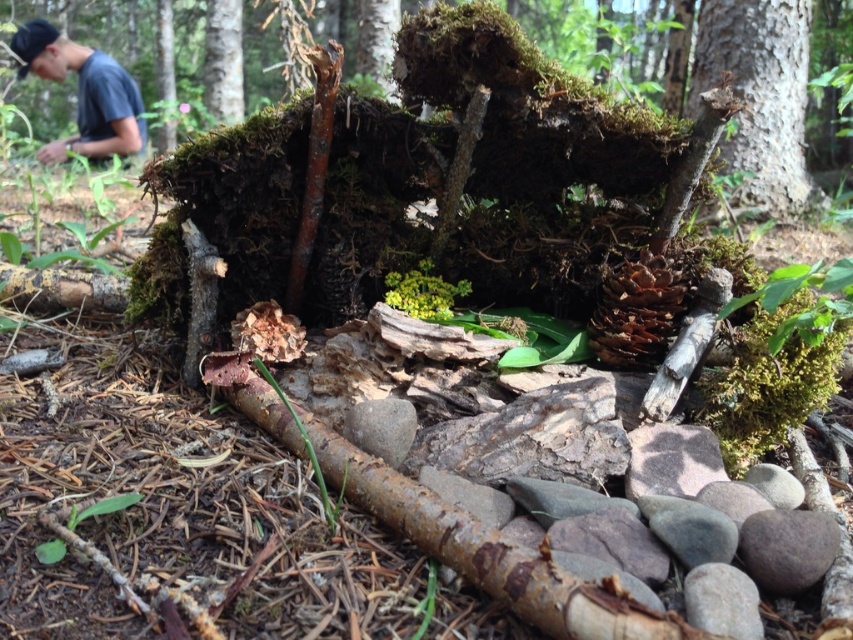
Question: Can you confirm if green mossy bark at upper right is positioned to the right of white smooth tree trunk at upper left?

Choices:
 (A) yes
 (B) no

Answer: (A)

Question: Estimate the real-world distances between objects in this image. Which object is closer to the white smooth tree trunk at upper left?

Choices:
 (A) brown rough pine cone at center-right
 (B) blue cotton shirt at upper left
 (C) green mossy bark at upper right

Answer: (B)

Question: Which object appears closest to the camera in this image?

Choices:
 (A) blue cotton shirt at upper left
 (B) brown rough pine cone at center-right
 (C) green mossy bark at upper right
 (D) white smooth tree trunk at upper left

Answer: (B)

Question: Which object is the closest to the brown rough pine cone at center-right?

Choices:
 (A) blue cotton shirt at upper left
 (B) white smooth tree trunk at upper left

Answer: (A)

Question: Can you confirm if green mossy bark at upper right is thinner than blue cotton shirt at upper left?

Choices:
 (A) yes
 (B) no

Answer: (A)

Question: Is blue cotton shirt at upper left smaller than brown rough pine cone at center-right?

Choices:
 (A) yes
 (B) no

Answer: (B)